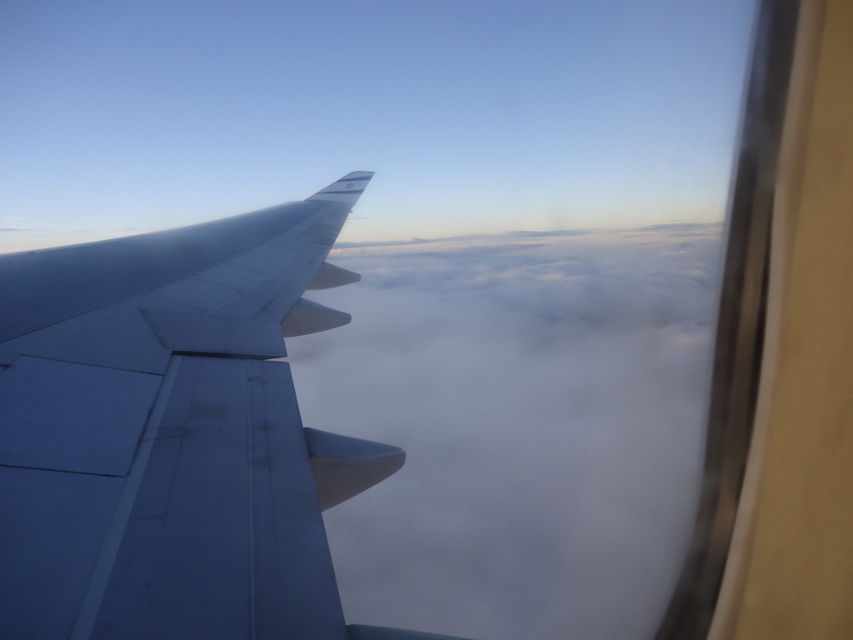
You are a passenger sitting in the airplane and looking out the window. You see the white fluffy cloud at center and the matte gray wing at left. Which object is closer to you?

The white fluffy cloud at center is closer to you because it is further to the viewer than the matte gray wing at left.

You are sitting in an airplane seat and looking out the window. You notice two points in the scene, one at point coordinates point (680, 449) and another at point coordinates point (271, 224). Which point is closer to your eyes?

Point (271, 224) is closer to your eyes because it is less further to the camera than point (680, 449).